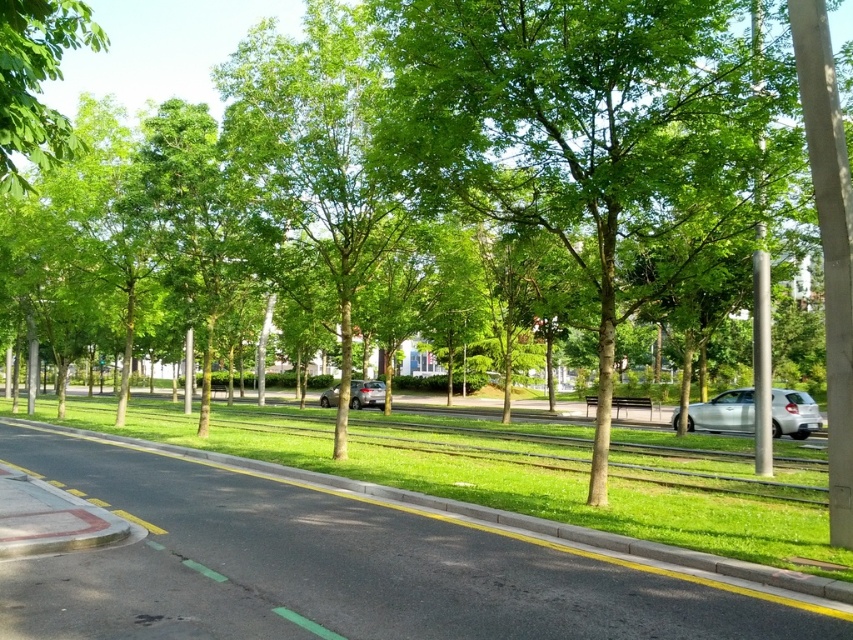
You are a delivery person with a 16 feet long trailer. You need to park your trailer between the black asphalt pavement at center and the green leafy tree at upper left. Is there enough space for your trailer to fit without overlapping either of them?

The distance between the black asphalt pavement at center and the green leafy tree at upper left is 15.74 feet. Since the trailer is 16 feet long, it would not fit within this space without overlapping one or both of them.

You are standing at the entrance of the park and notice the black asphalt pavement at center. Based on its coordinates, can you determine its position relative to the park entrance?

The black asphalt pavement at center is located at point 0.889 on the x axis and 0.401 on the y axis, so it is positioned to the right and slightly forward from the park entrance.

You are a delivery person trying to decide which vehicle to park closer to the curb. The silver metallic car at right and the satin silver sedan at center are both available. Which vehicle should you choose if you want to park as close to the curb as possible?

The silver metallic car at right has a lesser height compared to the satin silver sedan at center. Therefore, you should park the silver metallic car at right closer to the curb since it is shorter and less likely to obstruct the view or block the path.